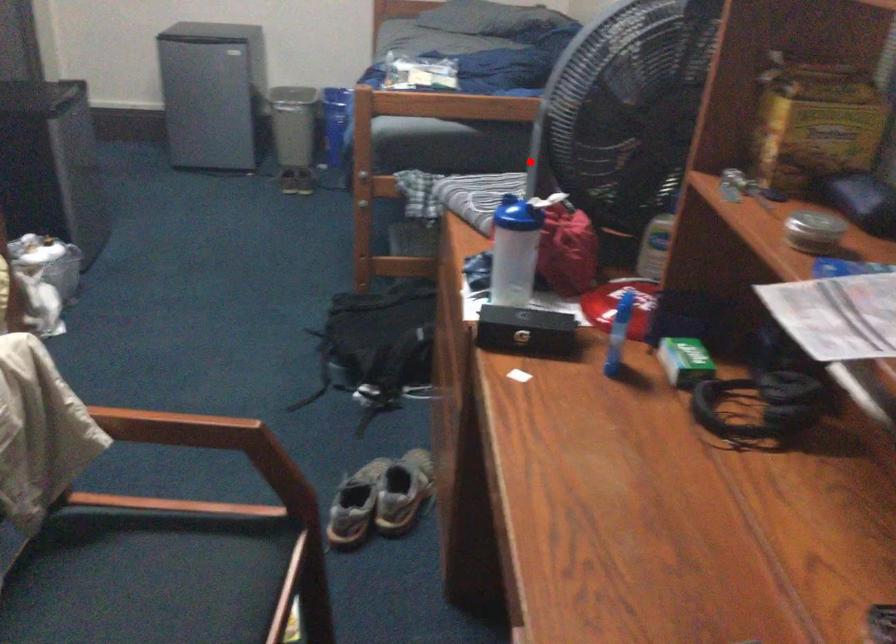
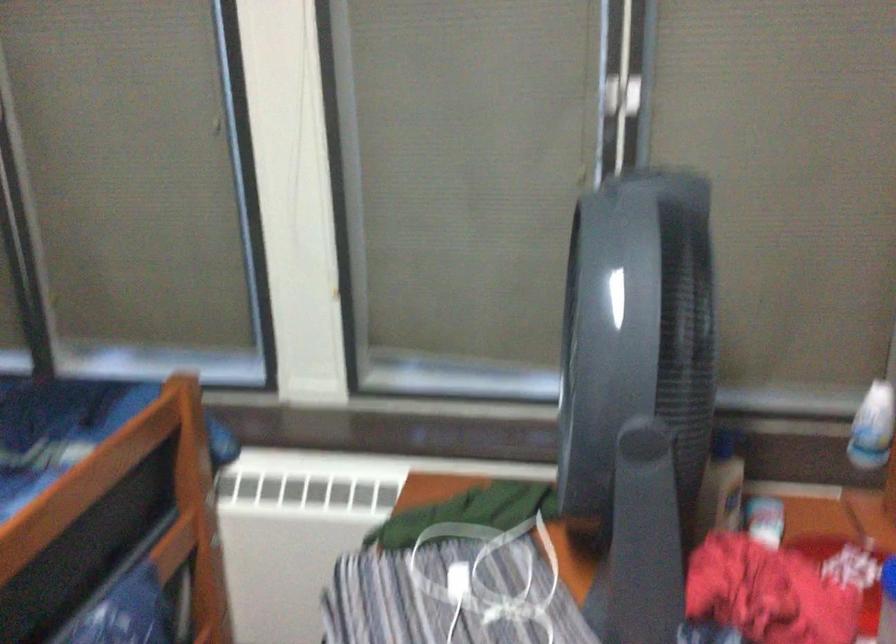
Find the pixel in the second image that matches the highlighted location in the first image.

(645, 521)